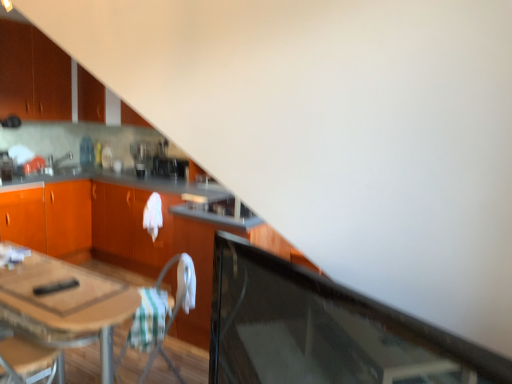
Question: Is matte orange cabinet at upper left, the 3th cabinetry from the bottom, located outside matte silver sink at upper left?

Choices:
 (A) no
 (B) yes

Answer: (B)

Question: Is matte orange cabinet at upper left, marked as the 1th cabinetry in a top-to-bottom arrangement, to the right of matte silver sink at upper left from the viewer's perspective?

Choices:
 (A) yes
 (B) no

Answer: (B)

Question: Considering the relative sizes of matte orange cabinet at upper left, marked as the 1th cabinetry in a top-to-bottom arrangement, and matte silver sink at upper left in the image provided, is matte orange cabinet at upper left, marked as the 1th cabinetry in a top-to-bottom arrangement, wider than matte silver sink at upper left?

Choices:
 (A) yes
 (B) no

Answer: (A)

Question: Considering the relative sizes of matte orange cabinet at upper left, marked as the 1th cabinetry in a top-to-bottom arrangement, and matte silver sink at upper left in the image provided, is matte orange cabinet at upper left, marked as the 1th cabinetry in a top-to-bottom arrangement, bigger than matte silver sink at upper left?

Choices:
 (A) yes
 (B) no

Answer: (A)

Question: Is matte orange cabinet at upper left, marked as the 1th cabinetry in a top-to-bottom arrangement, to the left of matte silver sink at upper left from the viewer's perspective?

Choices:
 (A) yes
 (B) no

Answer: (A)

Question: Is point (166, 175) closer or farther from the camera than point (153, 342)?

Choices:
 (A) farther
 (B) closer

Answer: (A)

Question: Based on their positions, is satin black coffee maker at center, acting as the 1th appliance starting from the back, located to the left or right of white fabric folding chair at center?

Choices:
 (A) left
 (B) right

Answer: (A)

Question: From a real-world perspective, is satin black coffee maker at center, which is the second appliance from left to right, physically located above or below white fabric folding chair at center?

Choices:
 (A) above
 (B) below

Answer: (A)

Question: In terms of width, does satin black coffee maker at center, which appears as the first appliance when viewed from the right, look wider or thinner when compared to white fabric folding chair at center?

Choices:
 (A) wide
 (B) thin

Answer: (B)

Question: In the image, is transparent glass door at lower right positioned in front of or behind matte orange cabinet at upper left, which is the second cabinetry from bottom to top?

Choices:
 (A) behind
 (B) front

Answer: (B)

Question: Is transparent glass door at lower right spatially inside matte orange cabinet at upper left, which is the second cabinetry from bottom to top, or outside of it?

Choices:
 (A) outside
 (B) inside

Answer: (A)

Question: Would you say transparent glass door at lower right is to the left or to the right of matte orange cabinet at upper left, acting as the second cabinetry starting from the top, in the picture?

Choices:
 (A) left
 (B) right

Answer: (B)

Question: Does point (230, 347) appear closer or farther from the camera than point (26, 61)?

Choices:
 (A) closer
 (B) farther

Answer: (A)

Question: Relative to matte silver sink at upper left, is matte orange cabinet at upper left, which is the second cabinetry from bottom to top, in front or behind?

Choices:
 (A) front
 (B) behind

Answer: (A)

Question: In the image, is matte orange cabinet at upper left, which is the second cabinetry from bottom to top, on the left side or the right side of matte silver sink at upper left?

Choices:
 (A) left
 (B) right

Answer: (B)